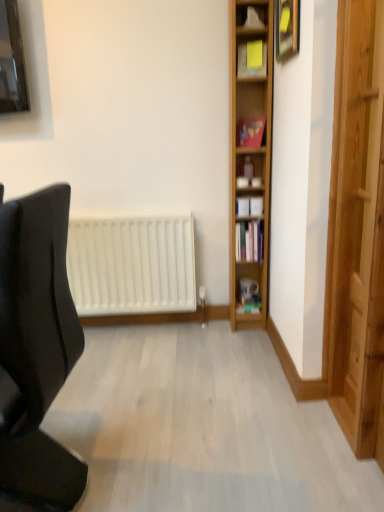
Question: From the image's perspective, is light brown wooden shelf at right, marked as the 1th shelf in a bottom-to-top arrangement, positioned above or below matte gold picture frame at upper right?

Choices:
 (A) below
 (B) above

Answer: (A)

Question: Is point (263, 231) positioned closer to the camera than point (297, 39)?

Choices:
 (A) farther
 (B) closer

Answer: (A)

Question: Estimate the real-world distances between objects in this image. Which object is closer to the black matte chair at left?

Choices:
 (A) light brown wooden shelf at right, marked as the 1th shelf in a bottom-to-top arrangement
 (B) matte gold picture frame at upper right
 (C) hardcover book at center-right, arranged as the 2th book when viewed from the back
 (D) yellow paper at upper center, the first shelf viewed from the top
 (E) green matte book at lower right, the 1th book from the back

Answer: (B)

Question: Which of these objects is positioned closest to the light brown wooden shelf at right, positioned as the 2th shelf in top-to-bottom order?

Choices:
 (A) matte red book at center-right, which ranks as the third book in bottom-to-top order
 (B) green matte book at lower right, arranged as the 3th book when viewed from the front
 (C) black matte chair at left
 (D) matte gold picture frame at upper right
 (E) hardcover book at center-right, which is counted as the second book, starting from the top

Answer: (A)